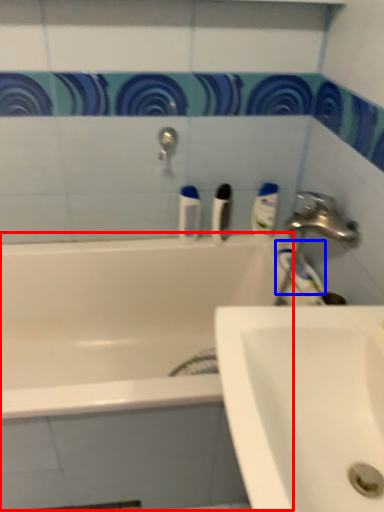
Question: Among these objects, which one is nearest to the camera, bath (highlighted by a red box) or toothpaste (highlighted by a blue box)?

Choices:
 (A) bath
 (B) toothpaste

Answer: (A)